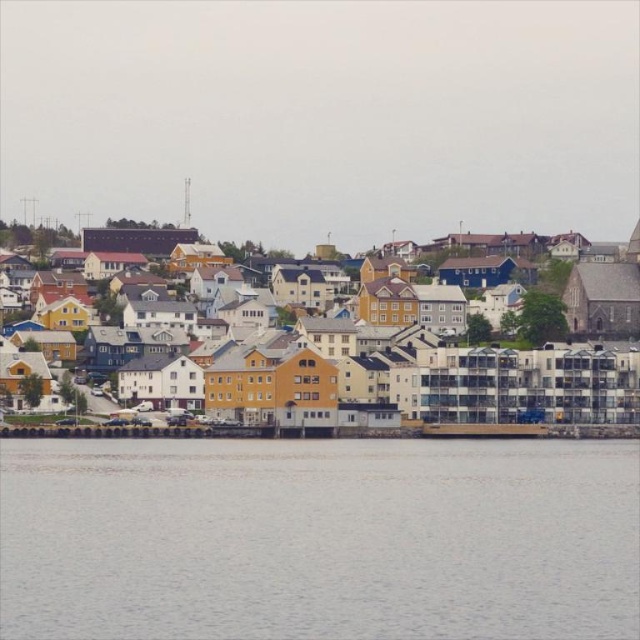
Can you confirm if gray water at lower center is taller than yellow matte building at center?

In fact, gray water at lower center may be shorter than yellow matte building at center.

Is gray water at lower center positioned at the back of yellow matte building at center?

No, gray water at lower center is in front of yellow matte building at center.

Does point (541, 624) come behind point (547, 404)?

That is False.

At what (x,y) coordinates should I click in order to perform the action: click on gray water at lower center. Please return your answer as a coordinate pair (x, y). This screenshot has height=640, width=640. Looking at the image, I should click on (317, 538).